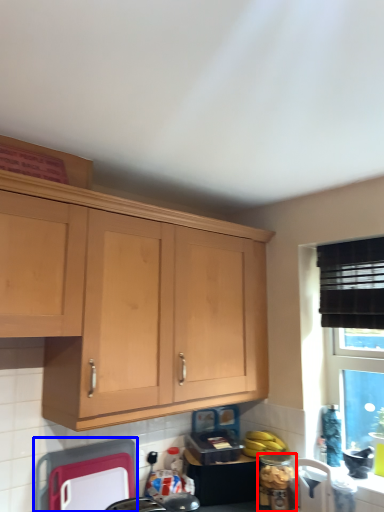
Question: Which object appears farthest to the camera in this image, appliance (highlighted by a red box) or appliance (highlighted by a blue box)?

Choices:
 (A) appliance
 (B) appliance

Answer: (A)